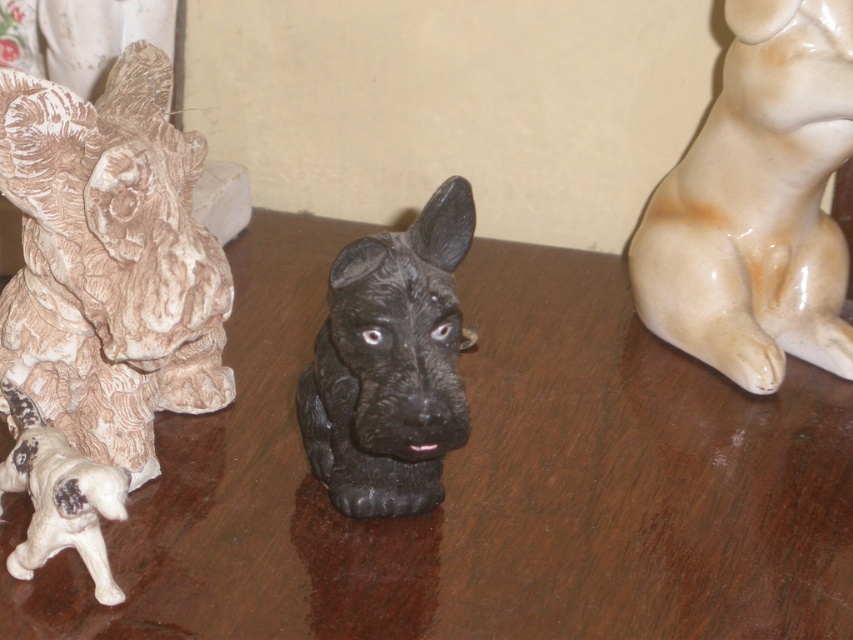
Is matte white dog at right positioned in front of white matte dog at lower left?

No, matte white dog at right is further to the viewer.

This screenshot has width=853, height=640. I want to click on matte white dog at right, so (x=757, y=204).

Does point (724, 300) come in front of point (67, 538)?

No, it is not.

This screenshot has height=640, width=853. In order to click on matte white dog at right in this screenshot , I will do `click(757, 204)`.

Does shiny brown table at center appear over black matte dog at center?

Actually, shiny brown table at center is below black matte dog at center.

Can you confirm if shiny brown table at center is taller than black matte dog at center?

Correct, shiny brown table at center is much taller as black matte dog at center.

This screenshot has width=853, height=640. In order to click on shiny brown table at center in this screenshot , I will do `click(480, 483)`.

Looking at this image, who is higher up, matte white dog at right or black matte dog at center?

matte white dog at right

Is matte white dog at right shorter than black matte dog at center?

Incorrect, matte white dog at right's height does not fall short of black matte dog at center's.

Is point (820, 70) in front of point (431, 266)?

That is False.

What are the coordinates of `matte white dog at right` in the screenshot? It's located at (757, 204).